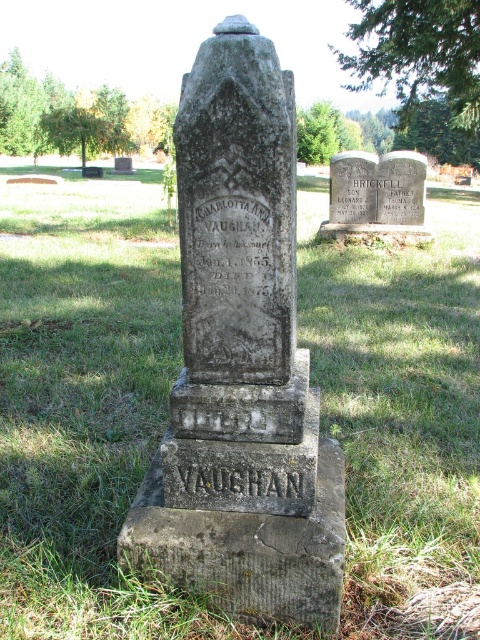
What are the coordinates of the gray stone gravestone at center?

The gray stone gravestone at center is located at coordinates point (241, 364).

Based on the photo, you are standing at point (85,403) in the cemetery. What do you see directly in front of you?

You see green grass at center directly in front of you at point (85,403).